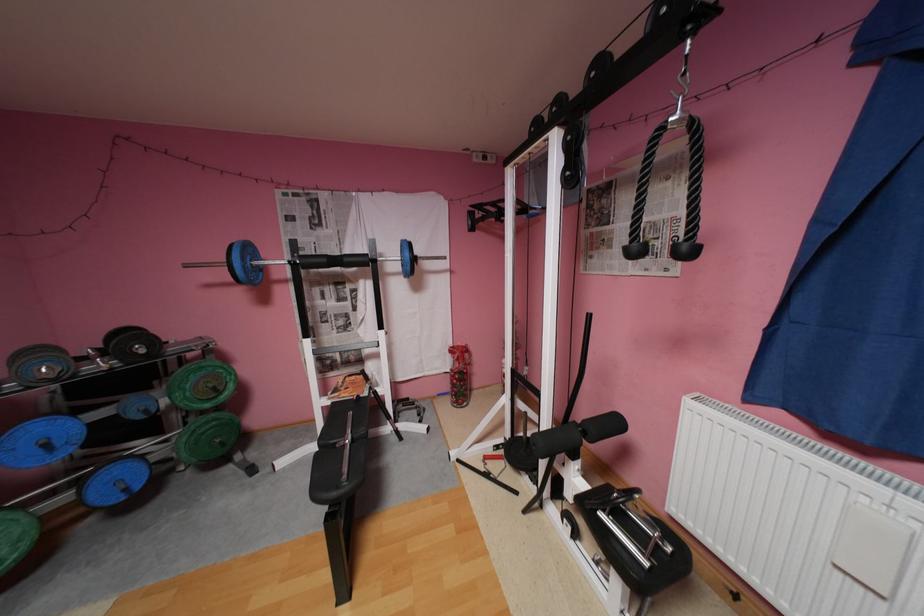
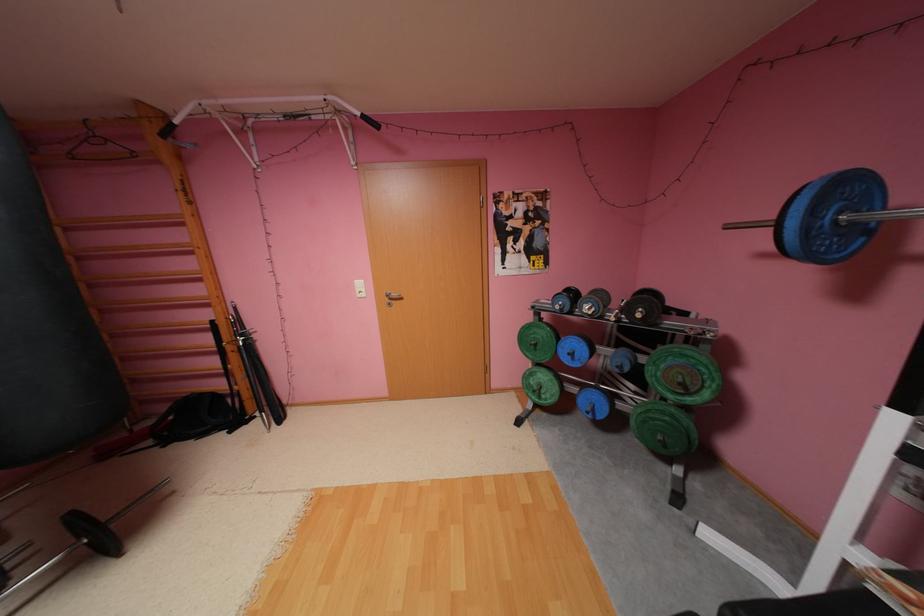
In the second image, find the point that corresponds to point 253,268 in the first image.

(816, 229)